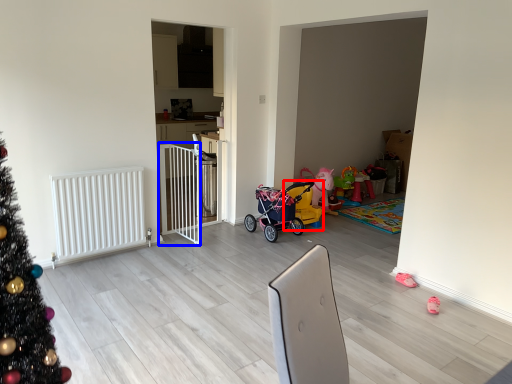
Question: Which object is further to the camera taking this photo, baby carriage (highlighted by a red box) or balustrade (highlighted by a blue box)?

Choices:
 (A) baby carriage
 (B) balustrade

Answer: (A)